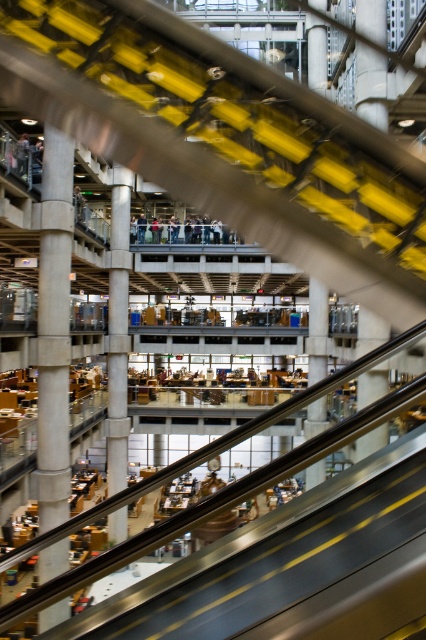
You are a person standing in the modern multi level building and you want to know if you can fit through the space between the concrete pillar at center and the dark blue jeans at center. Can you?

The concrete pillar at center is taller than dark blue jeans at center. Since the pillar is taller, it would block the upper part of your body, making it difficult to pass through the space between them comfortably.

In the scene shown: You are standing at the entrance of this modern building and want to reach the information desk located behind the concrete pillar at center. The distance from your current position to the pillar is 23.26 feet. If you walk at a speed of 3 feet per second, how many seconds will it take you to reach the information desk?

The distance to the concrete pillar at center is 23.26 feet. At a walking speed of 3 feet per second, it will take approximately 7.75 seconds to reach the pillar. Since the information desk is behind the pillar, you will arrive there after covering that distance.

You are a delivery person carrying a box that is 1.5 meters tall. You need to pass through the space between the concrete pillar at center and the concrete at center. Can your box fit through the gap vertically?

The concrete pillar at center is much taller than the concrete at center, so the gap between them is determined by the height of the shorter object, which is the concrete at center. Since the box is 1.5 meters tall, if the concrete at center is taller than 1.5 meters, the box can fit. However, the exact height isn